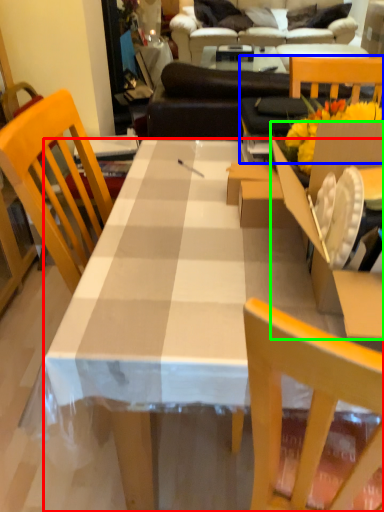
Question: Which object is positioned closest to desk (highlighted by a red box)? Select from chair (highlighted by a blue box) and cardboard box (highlighted by a green box).

Choices:
 (A) chair
 (B) cardboard box

Answer: (B)